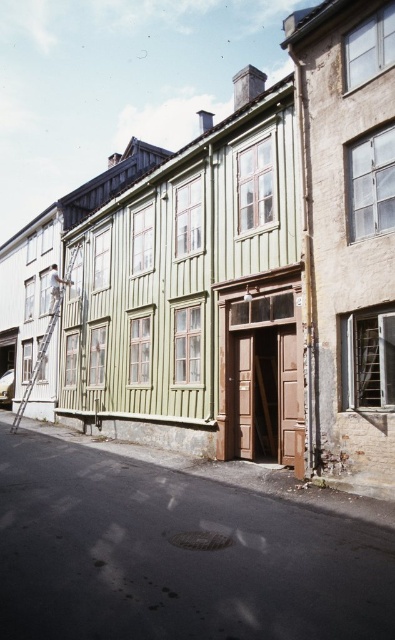
Question: Which point is farther to the camera?

Choices:
 (A) light brown wooden ladder at upper left
 (B) metallic silver ladder at left

Answer: (A)

Question: From the image, what is the correct spatial relationship of metallic silver ladder at left in relation to light brown wooden ladder at upper left?

Choices:
 (A) left
 (B) right

Answer: (A)

Question: Among these objects, which one is farthest from the camera?

Choices:
 (A) light brown wooden ladder at upper left
 (B) metallic silver ladder at left

Answer: (A)

Question: Can you confirm if metallic silver ladder at left is bigger than light brown wooden ladder at upper left?

Choices:
 (A) yes
 (B) no

Answer: (A)

Question: Is metallic silver ladder at left below light brown wooden ladder at upper left?

Choices:
 (A) yes
 (B) no

Answer: (A)